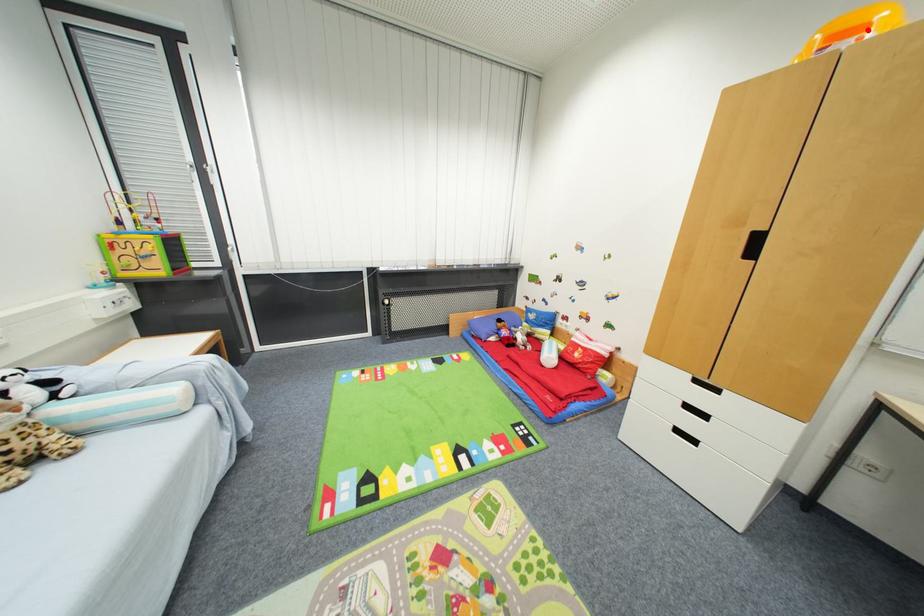
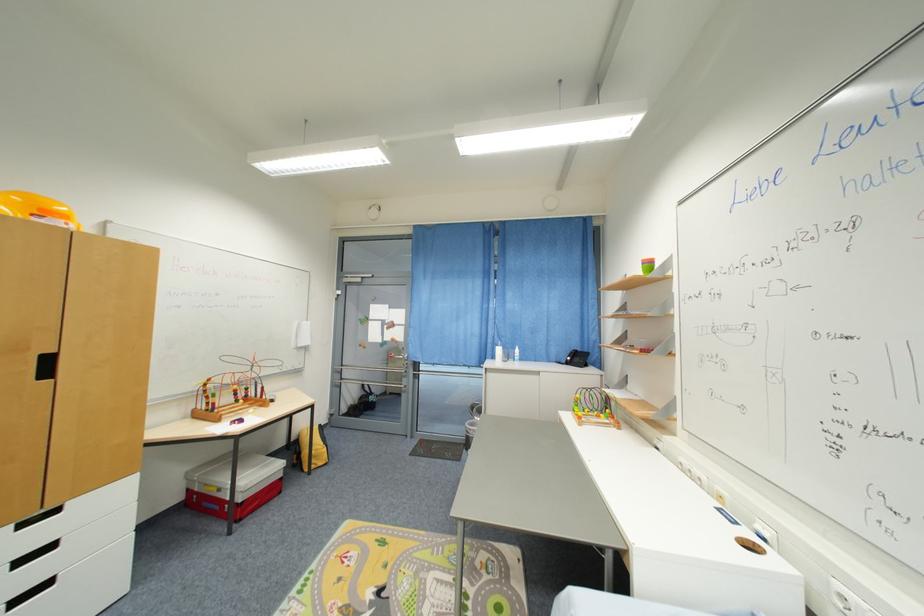
The point at the highlighted location is marked in the first image. Where is the corresponding point in the second image?

(69, 217)